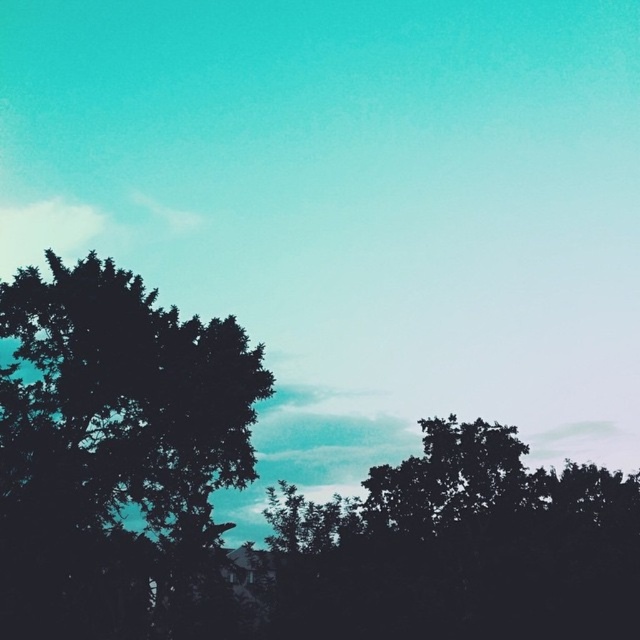
Question: Does dark green leafy tree at left appear on the left side of silhouette leafy tree at center?

Choices:
 (A) no
 (B) yes

Answer: (B)

Question: Which point appears closest to the camera in this image?

Choices:
 (A) (182, 417)
 (B) (545, 541)

Answer: (B)

Question: Among these objects, which one is nearest to the camera?

Choices:
 (A) dark green leafy tree at left
 (B) silhouette leafy tree at center

Answer: (A)

Question: Does dark green leafy tree at left have a lesser width compared to silhouette leafy tree at center?

Choices:
 (A) no
 (B) yes

Answer: (B)

Question: Considering the relative positions of dark green leafy tree at left and silhouette leafy tree at center in the image provided, where is dark green leafy tree at left located with respect to silhouette leafy tree at center?

Choices:
 (A) below
 (B) above

Answer: (B)

Question: Among these objects, which one is nearest to the camera?

Choices:
 (A) dark green leafy tree at left
 (B) silhouette leafy tree at center

Answer: (A)